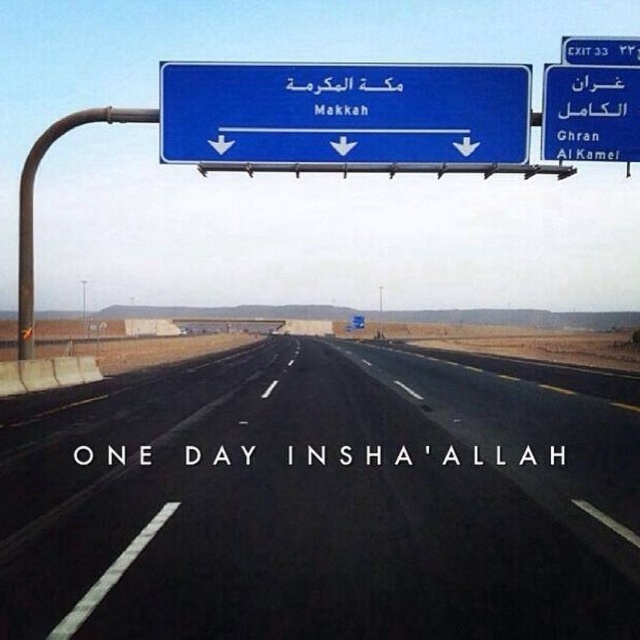
Question: Which point is farther from the camera taking this photo?

Choices:
 (A) (384, 118)
 (B) (378, 288)
 (C) (573, 141)
 (D) (538, 500)

Answer: (B)

Question: Does blue plastic exit sign at upper right have a smaller size compared to metallic pole at center?

Choices:
 (A) no
 (B) yes

Answer: (B)

Question: Estimate the real-world distances between objects in this image. Which object is closer to the blue plastic exit sign at upper right?

Choices:
 (A) black asphalt highway at center
 (B) blue plastic sign at upper right
 (C) metallic pole at center

Answer: (B)

Question: Which of the following is the closest to the observer?

Choices:
 (A) click(x=296, y=141)
 (B) click(x=620, y=97)

Answer: (A)

Question: Considering the relative positions of blue metallic sign at center and metallic pole at center in the image provided, where is blue metallic sign at center located with respect to metallic pole at center?

Choices:
 (A) left
 (B) right

Answer: (A)

Question: Is blue metallic sign at center thinner than blue plastic sign at upper right?

Choices:
 (A) yes
 (B) no

Answer: (B)